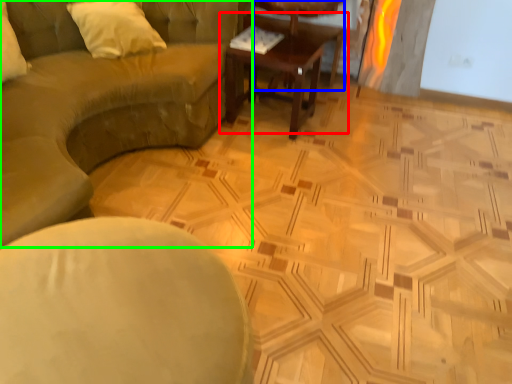
Question: Estimate the real-world distances between objects in this image. Which object is closer to coffee table (highlighted by a red box), cocktail table (highlighted by a blue box) or studio couch (highlighted by a green box)?

Choices:
 (A) cocktail table
 (B) studio couch

Answer: (A)